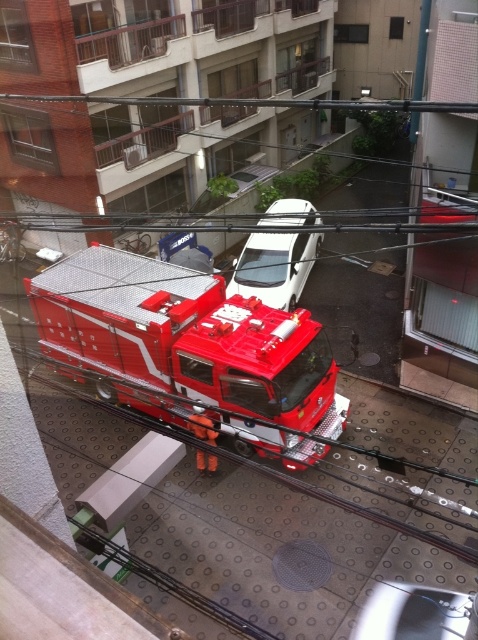
Question: Can you confirm if white matte van at center is thinner than metallic silver car at center?

Choices:
 (A) yes
 (B) no

Answer: (A)

Question: Which point is closer to the camera?

Choices:
 (A) (417, 592)
 (B) (254, 240)

Answer: (A)

Question: Which point is closer to the camera taking this photo?

Choices:
 (A) (425, 628)
 (B) (162, 364)
 (C) (285, 198)

Answer: (A)

Question: Can you confirm if white matte van at center is positioned above metallic silver car at center?

Choices:
 (A) no
 (B) yes

Answer: (B)

Question: Which object is closer to the camera taking this photo?

Choices:
 (A) metallic silver car at center
 (B) metallic red fire truck at center
 (C) white matte van at center

Answer: (A)

Question: Is white matte van at center to the left of metallic silver car at center from the viewer's perspective?

Choices:
 (A) yes
 (B) no

Answer: (A)